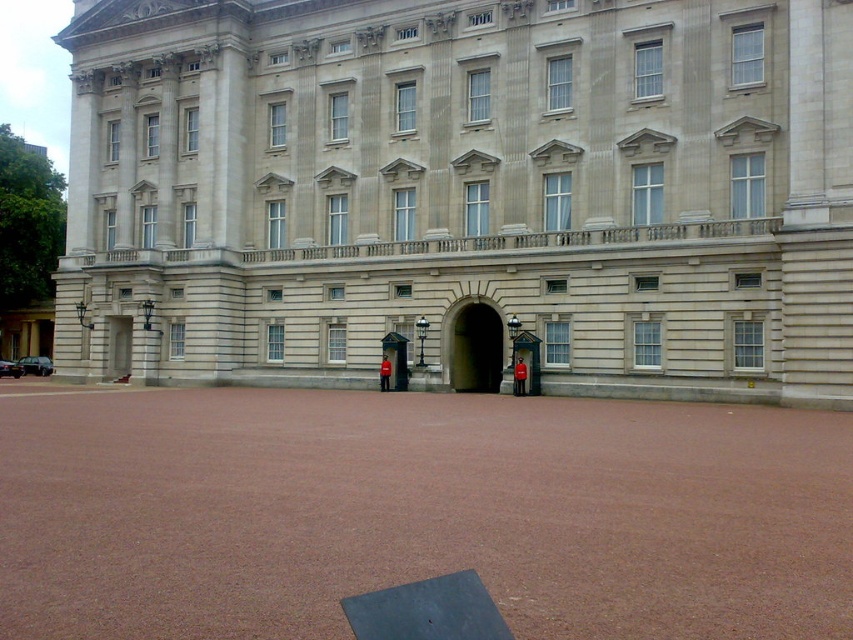
Question: Does red uniform at center appear under red uniformed guard at center?

Choices:
 (A) no
 (B) yes

Answer: (B)

Question: Can you confirm if smooth stone archway at center is positioned to the left of red uniformed guard at center?

Choices:
 (A) yes
 (B) no

Answer: (A)

Question: Which object is closer to the camera taking this photo?

Choices:
 (A) red uniform at center
 (B) light gray stone building at center
 (C) smooth stone door at left
 (D) red uniformed guard at center

Answer: (B)

Question: Does smooth stone archway at center have a lesser width compared to smooth stone door at left?

Choices:
 (A) yes
 (B) no

Answer: (B)

Question: Which of these objects is positioned farthest from the red uniformed guard at center?

Choices:
 (A) light gray stone building at center
 (B) smooth stone archway at center

Answer: (A)

Question: Which of the following is the closest to the observer?

Choices:
 (A) (386, 342)
 (B) (676, 49)

Answer: (B)